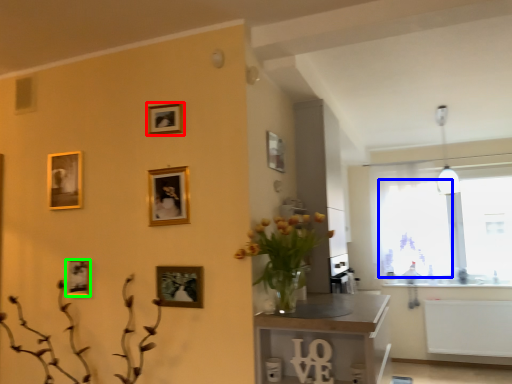
Question: Which is farther away from picture frame (highlighted by a red box)? window screen (highlighted by a blue box) or picture frame (highlighted by a green box)?

Choices:
 (A) window screen
 (B) picture frame

Answer: (A)